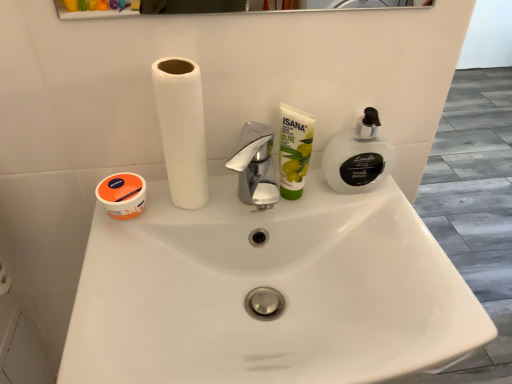
The image size is (512, 384). In order to click on vacant space in between orange matte cream at left and green matte olive oil cream at center in this screenshot , I will do `click(220, 208)`.